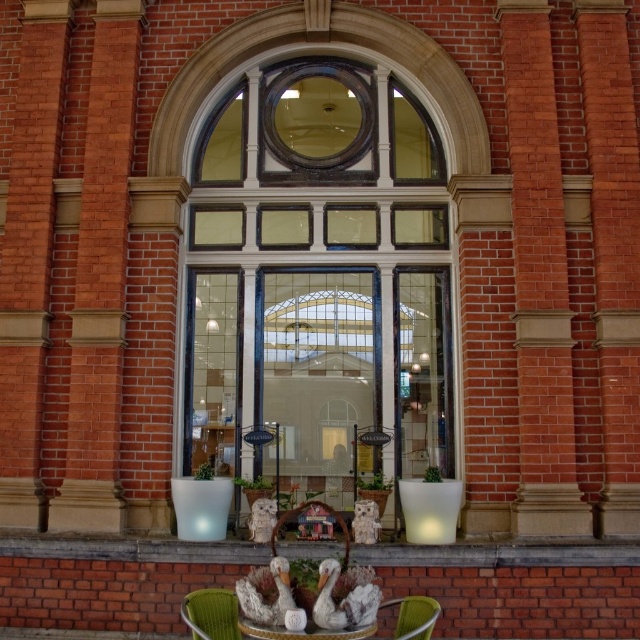
Is the position of clear glass door at center more distant than that of wooden chair at center?

Yes.

Can you confirm if clear glass door at center is smaller than wooden chair at center?

Incorrect, clear glass door at center is not smaller in size than wooden chair at center.

Is point (397, 412) closer to camera compared to point (284, 524)?

No, (397, 412) is behind (284, 524).

Identify the location of clear glass door at center. This screenshot has width=640, height=640. (320, 280).

Looking at this image, does clear glass door at center have a larger size compared to metallic green chair at lower center?

Yes, clear glass door at center is bigger than metallic green chair at lower center.

Is point (433, 204) positioned behind point (429, 621)?

Yes.

The width and height of the screenshot is (640, 640). Find the location of `clear glass door at center`. clear glass door at center is located at coordinates (320, 280).

Is green fabric chair at lower center above metallic green chair at lower center?

Correct, green fabric chair at lower center is located above metallic green chair at lower center.

Which is behind, point (204, 605) or point (422, 595)?

Point (422, 595)

At what (x,y) coordinates should I click in order to perform the action: click on green fabric chair at lower center. Please return your answer as a coordinate pair (x, y). The width and height of the screenshot is (640, 640). Looking at the image, I should click on (211, 612).